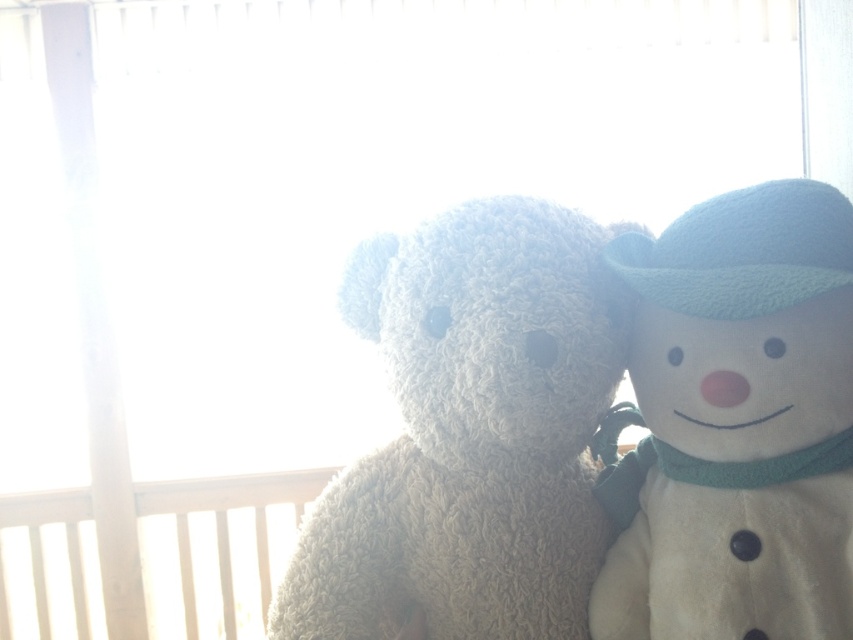
You are a child who wants to place both the fluffy beige teddy bear at center and the white plush snowman at right on a shelf that is 6 inches wide. Can they fit side by side without overlapping?

The fluffy beige teddy bear at center and the white plush snowman at right are 5.60 inches apart from each other. Since the shelf is 6 inches wide, they can fit side by side as the total width required is less than the shelf width.

You are a child who wants to pick up both the fluffy beige teddy bear at center and the white plush snowman at right from the floor. Which one do you need to bend down more to pick up?

The fluffy beige teddy bear at center is located below the white plush snowman at right, so you need to bend down more to pick up the fluffy beige teddy bear at center.

You are standing in front of the two plush toys. You notice two points marked in the image. One is at coordinates point (x=416, y=584) and the other at point (x=706, y=324). Which point is closer to you?

Point (x=416, y=584) is further to the viewer than point (x=706, y=324), so the point at (x=416, y=584) is closer to you.